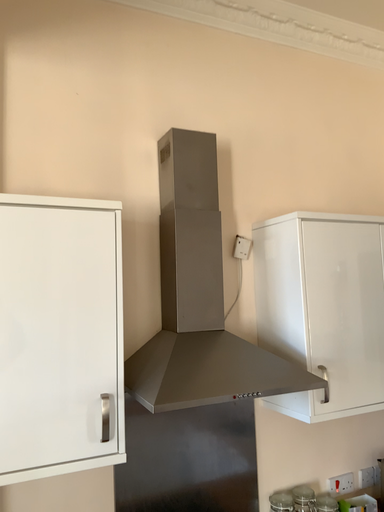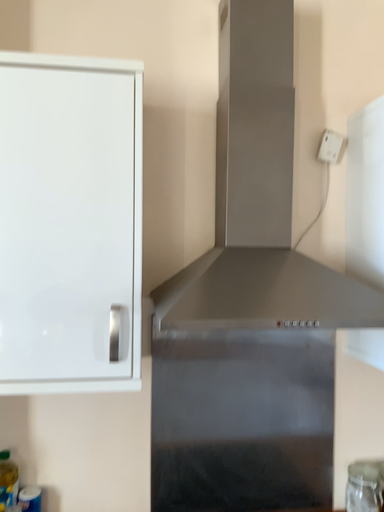
Question: How did the camera likely rotate when shooting the video?

Choices:
 (A) rotated left
 (B) rotated right

Answer: (A)